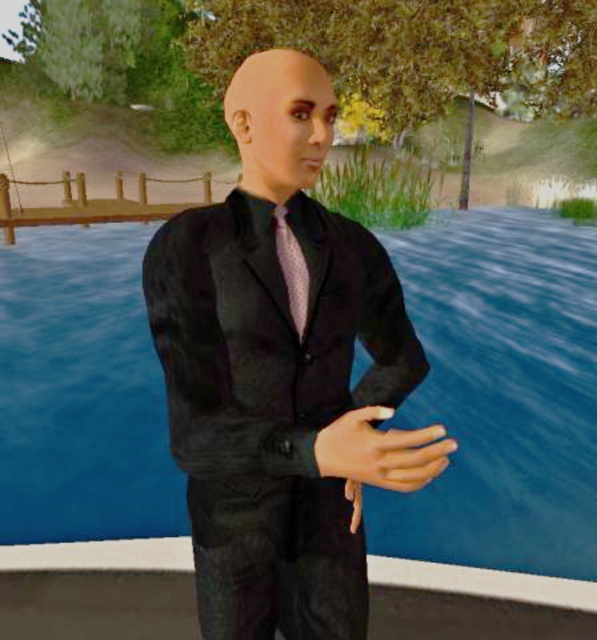
You are a photographer at the scene. You need to adjust the camera focus to capture both the black satin suit at center and the pink dotted fabric tie at center clearly. Given their sizes, which one should you focus on first to ensure both are in focus?

The black satin suit at center is much taller as pink dotted fabric tie at center, so focusing on the larger black satin suit at center first would help ensure both are in focus.

You are a photographer taking a portrait of the person in the scene. You want to ensure the black satin suit at center and the pink dotted fabric tie at center are both clearly visible. Which item should you adjust the camera focus on first to ensure proper depth of field?

The black satin suit at center is positioned on the right side of pink dotted fabric tie at center, so you should focus on the pink dotted fabric tie at center first to ensure both items are in focus due to its position closer to the camera.